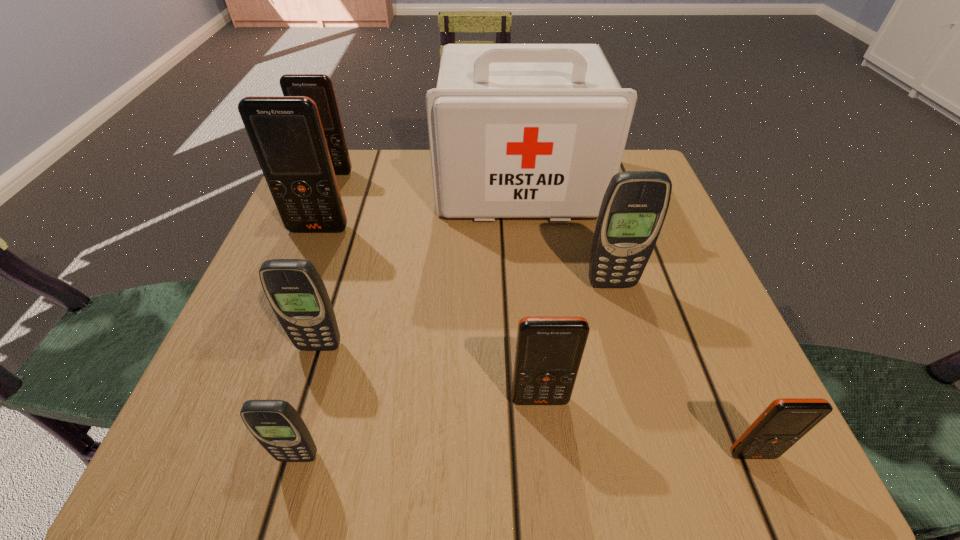
In the image, there is a desktop. Where is `vacant region at the far left corner`? The height and width of the screenshot is (540, 960). vacant region at the far left corner is located at coordinates (378, 166).

You are a GUI agent. You are given a task and a screenshot of the screen. Output one action in this format:
    pyautogui.click(x=<x>, y=<y>)
    Task: Click on the blank space at the near right corner
    The image size is (960, 540).
    Given the screenshot: What is the action you would take?
    pyautogui.click(x=715, y=419)

The image size is (960, 540). Find the location of `vacant space in between the rightmost cellular telephone and the fifth nearest object`. vacant space in between the rightmost cellular telephone and the fifth nearest object is located at coordinates (682, 369).

Identify the location of free point between the nearest orange cellular telephone and the nearest gray cellular telephone. The width and height of the screenshot is (960, 540). (525, 456).

Image resolution: width=960 pixels, height=540 pixels. In order to click on vacant area that lies between the nearest orange cellular telephone and the fifth cellular telephone from left to right in this screenshot , I will do `click(646, 427)`.

You are a GUI agent. You are given a task and a screenshot of the screen. Output one action in this format:
    pyautogui.click(x=<x>, y=<y>)
    Task: Click on the free space between the farthest orange cellular telephone and the second biggest gray cellular telephone
    This screenshot has width=960, height=540.
    Given the screenshot: What is the action you would take?
    pyautogui.click(x=325, y=260)

Identify the location of free point between the white first-aid kit and the third nearest object. (529, 293).

In order to click on empty location between the biggest orange cellular telephone and the white first-aid kit in this screenshot , I will do `click(419, 207)`.

Find the location of a particular element. The height and width of the screenshot is (540, 960). object that is the second closest to the fifth nearest object is located at coordinates (549, 349).

Identify which object is the sixth nearest to the second farthest cellular telephone. Please provide its 2D coordinates. Your answer should be formatted as a tuple, i.e. [(x, y)], where the tuple contains the x and y coordinates of a point satisfying the conditions above.

[(549, 349)]